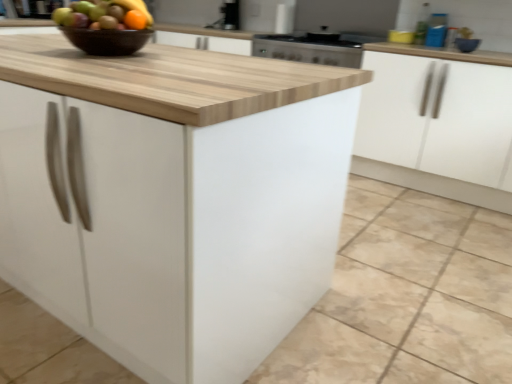
The height and width of the screenshot is (384, 512). What are the coordinates of `free space in front of blue glossy bowl at upper right` in the screenshot? It's located at (476, 54).